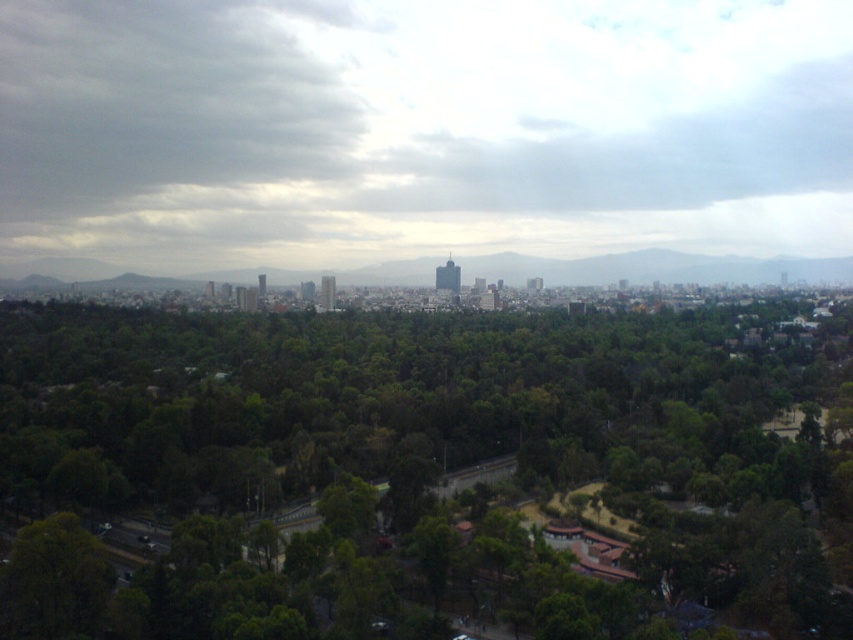
Can you confirm if green leafy trees at center is taller than gray/bluish stone mountains at center?

Correct, green leafy trees at center is much taller as gray/bluish stone mountains at center.

Which is in front, point (302, 465) or point (730, 259)?

Point (302, 465) is in front.

This screenshot has height=640, width=853. I want to click on green leafy trees at center, so click(412, 472).